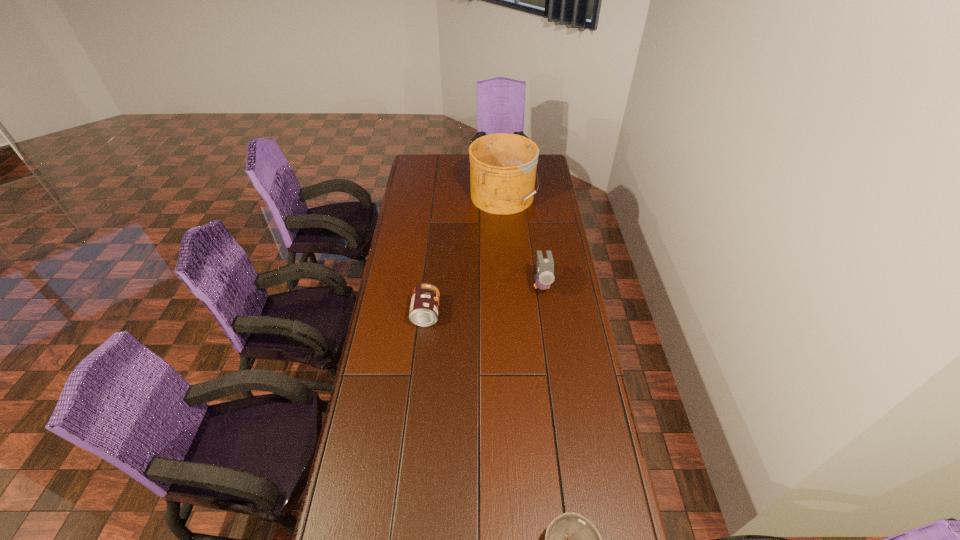
Find the location of a particular element. Image resolution: width=960 pixels, height=540 pixels. blank region between the second nearest object and the bird is located at coordinates (484, 299).

Image resolution: width=960 pixels, height=540 pixels. I want to click on free space that is in between the bucket and the bird, so click(x=522, y=240).

Where is `object identified as the second closest to the bowl`? This screenshot has width=960, height=540. object identified as the second closest to the bowl is located at coordinates (545, 266).

Identify which object is the third nearest to the tallest object. Please provide its 2D coordinates. Your answer should be formatted as a tuple, i.e. [(x, y)], where the tuple contains the x and y coordinates of a point satisfying the conditions above.

[(571, 539)]

Identify the location of free space that satisfies the following two spatial constraints: 1. at the beak of the second tallest object; 2. on the front label of the third tallest object. Image resolution: width=960 pixels, height=540 pixels. (545, 314).

I want to click on free space that satisfies the following two spatial constraints: 1. at the beak of the second farthest object; 2. on the front label of the second shortest object, so point(545,314).

I want to click on vacant position in the image that satisfies the following two spatial constraints: 1. at the beak of the third shortest object; 2. on the front label of the second shortest object, so click(545, 314).